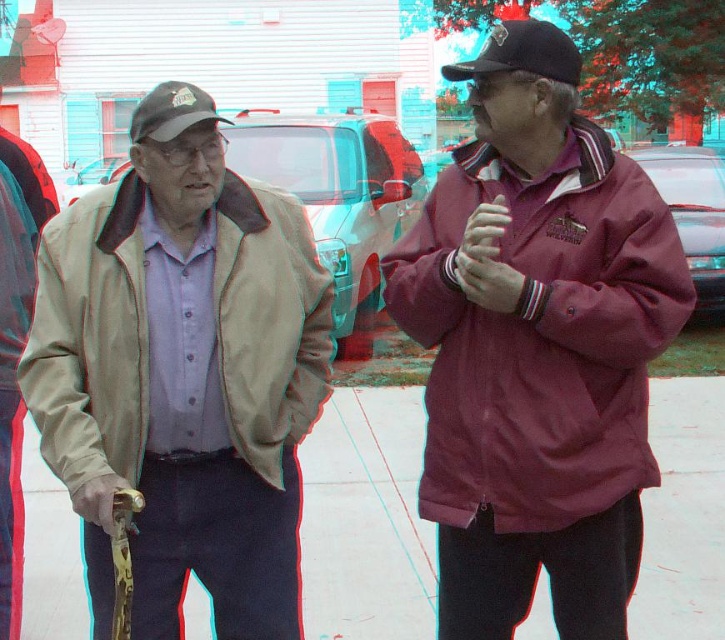
You are a delivery robot standing 2 meters away from the viewer. You need to deliver a package to the maroon fabric jacket at right. Can you reach them without moving closer?

The maroon fabric jacket at right is 2.48 meters away from the viewer. Since you are 2 meters away from the viewer, the distance between you and the maroon fabric jacket at right is 0.48 meters. Therefore, you can reach them without moving closer.

You are a delivery drone flying above a residential area. You need to land on the white concrete pavement at center while avoiding the black matte baseball cap at upper right. Can you safely land on the pavement without hitting the cap?

The white concrete pavement at center has a lesser height compared to the black matte baseball cap at upper right, so the drone can safely land on the pavement as it is lower than the cap, ensuring no collision.

You are a delivery robot navigating a residential area. You need to move from your current position to the location of the person on the left. The white concrete pavement at center is the only clear path. What coordinates should you aim for to reach the person on the left?

The white concrete pavement at center is located at coordinates point [365,518]. Since the person on the left is standing near this path, you should aim for the coordinates point [365,518] to reach them.